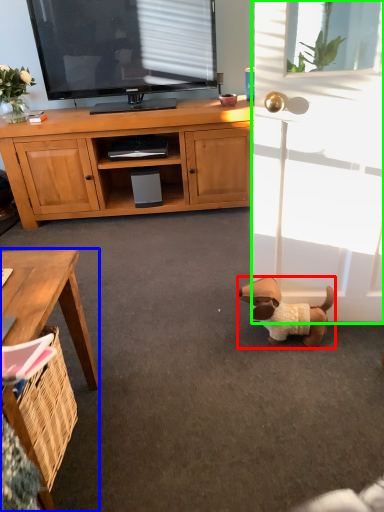
Question: Which is farther away from dog (highlighted by a red box)? desk (highlighted by a blue box) or screen door (highlighted by a green box)?

Choices:
 (A) desk
 (B) screen door

Answer: (A)